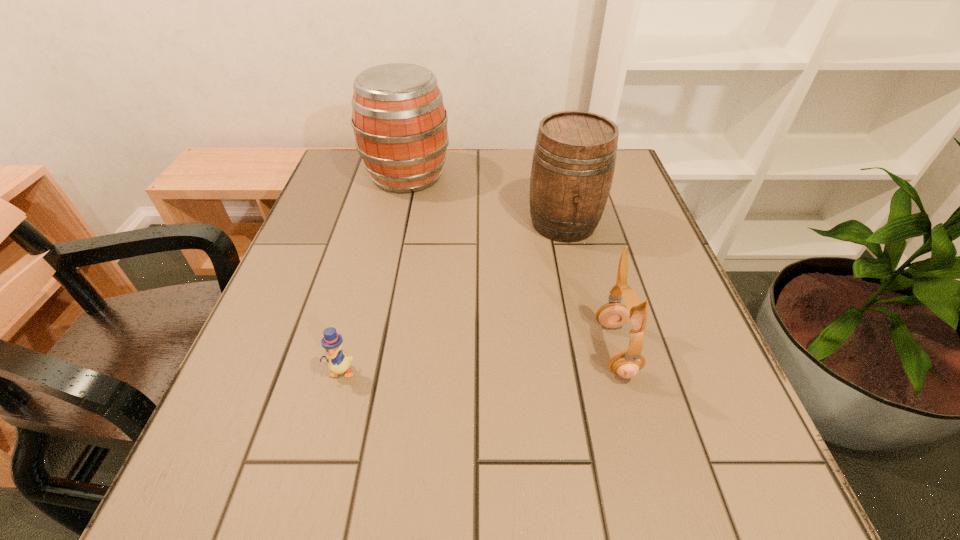
Identify the location of the farther cider. (399, 120).

This screenshot has height=540, width=960. Find the location of `the farthest object`. the farthest object is located at coordinates (399, 120).

Where is `the right cider`? the right cider is located at coordinates (574, 157).

Identify the location of the second farthest object. (574, 157).

Locate an element on the screen. This screenshot has height=540, width=960. the second shortest object is located at coordinates (626, 363).

At what (x,y) coordinates should I click in order to perform the action: click on duckling. Please return your answer as a coordinate pair (x, y). The width and height of the screenshot is (960, 540). Looking at the image, I should click on (338, 363).

At what (x,y) coordinates should I click in order to perform the action: click on vacant space located on the front of the left cider. Please return your answer as a coordinate pair (x, y). This screenshot has width=960, height=540. Looking at the image, I should click on (396, 228).

Locate an element on the screen. This screenshot has height=540, width=960. vacant area situated on the side of the nearer cider near the bung hole is located at coordinates (597, 370).

Find the location of a particular element. This screenshot has height=540, width=960. vacant position located on the front-facing side of the earphone is located at coordinates (477, 349).

You are a GUI agent. You are given a task and a screenshot of the screen. Output one action in this format:
    pyautogui.click(x=<x>, y=<y>)
    Task: Click on the blank area located 0.300m on the front-facing side of the earphone
    This screenshot has width=960, height=540.
    Given the screenshot: What is the action you would take?
    pyautogui.click(x=433, y=349)